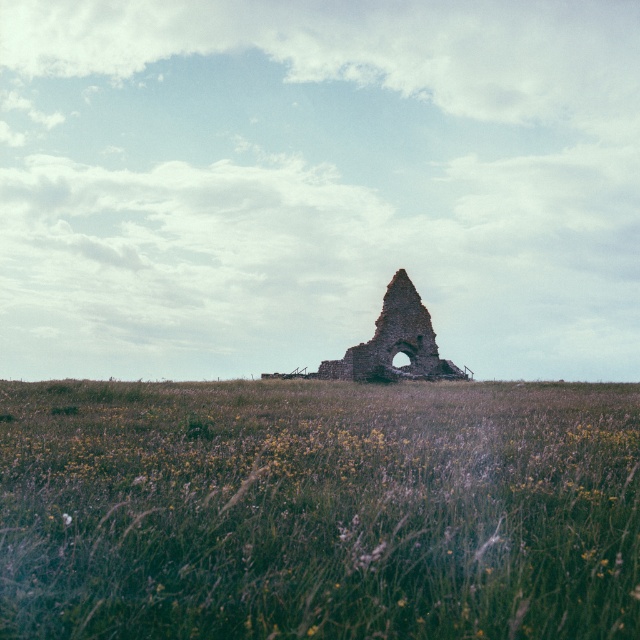
You are a photographer planning to capture a landscape photo that emphasizes the green grassy field at center and brown stone ruins at center. Given their sizes, which object should you focus on to ensure both are clearly visible in your shot?

The green grassy field at center has a smaller size compared to brown stone ruins at center. To ensure both are clearly visible, focus on the brown stone ruins at center since it is larger and will remain in focus while the smaller green grassy field at center will naturally be part of the composition without needing adjustment.

In the scene shown: You are standing at the point marked as point (x=317, y=509) in the image. Looking around, what do you see immediately around you?

The green grassy field at center is located at point (x=317, y=509), so you are standing in the green grassy field at center.